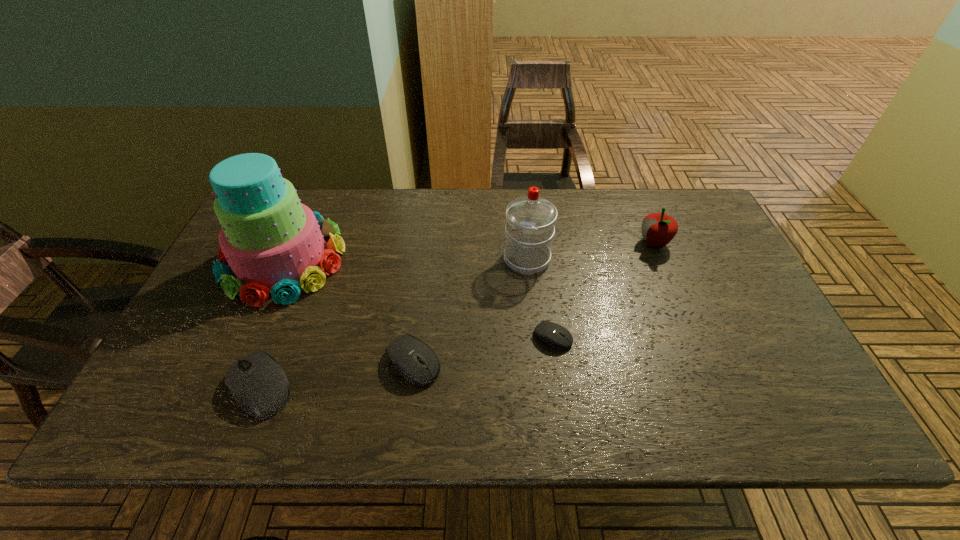
Identify the location of free space that satisfies the following two spatial constraints: 1. on the front side of the tallest object; 2. on the right side of the shortest object. (250, 337).

At what (x,y) coordinates should I click in order to perform the action: click on vacant space that satisfies the following two spatial constraints: 1. on the back side of the leftmost computer equipment; 2. on the right side of the second shortest computer equipment. Please return your answer as a coordinate pair (x, y). Looking at the image, I should click on (271, 361).

Where is `free space that satisfies the following two spatial constraints: 1. on the front side of the leftmost computer equipment; 2. on the left side of the cake`? free space that satisfies the following two spatial constraints: 1. on the front side of the leftmost computer equipment; 2. on the left side of the cake is located at coordinates (227, 388).

Identify the location of free space that satisfies the following two spatial constraints: 1. on the back side of the leftmost computer equipment; 2. on the left side of the shortest computer equipment. (280, 337).

This screenshot has width=960, height=540. I want to click on vacant space that satisfies the following two spatial constraints: 1. on the front side of the cake; 2. on the right side of the shortest computer equipment, so [x=250, y=337].